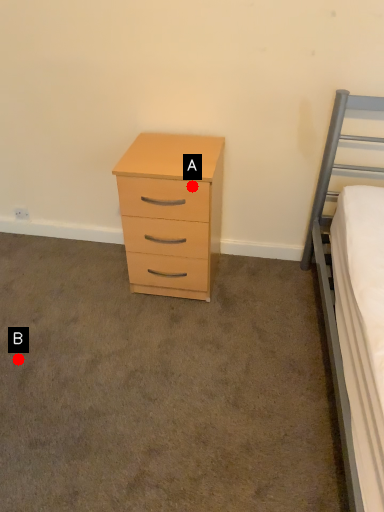
Question: Two points are circled on the image, labeled by A and B beside each circle. Which of the following is the closest to the observer?

Choices:
 (A) A is closer
 (B) B is closer

Answer: (A)